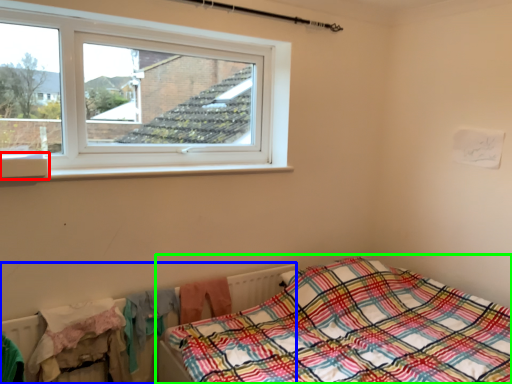
Question: Which is nearer to the window sill (highlighted by a red box)? radiator (highlighted by a blue box) or bed (highlighted by a green box).

Choices:
 (A) radiator
 (B) bed

Answer: (A)